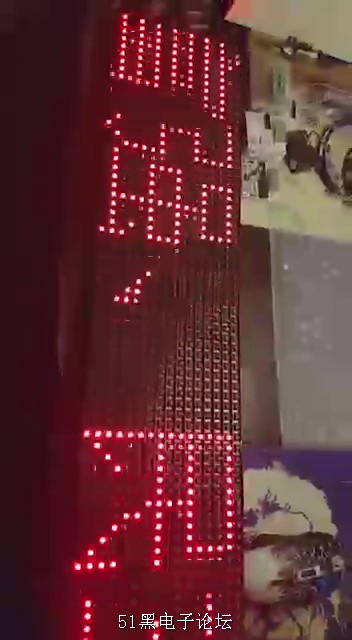
At what (x,y) coordinates should I click in order to perform the action: click on picture. Please return your answer as a coordinate pair (x, y). Looking at the image, I should click on (301, 212), (342, 486).